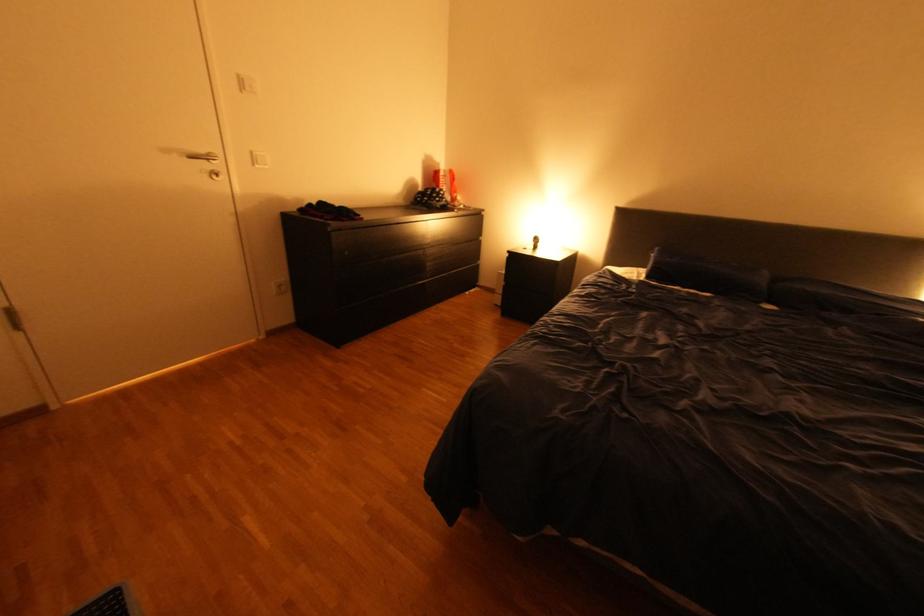
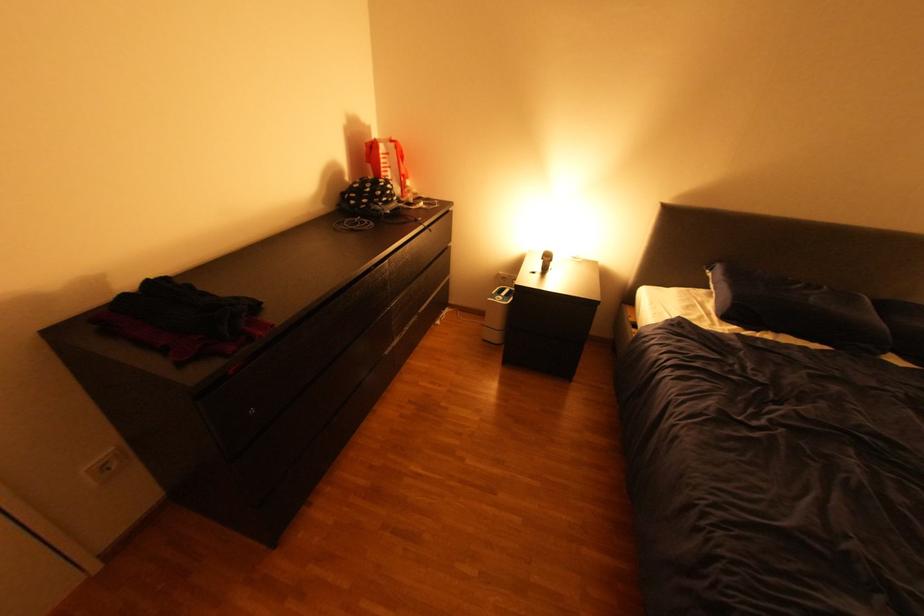
Find the pixel in the second image that matches pixel 549 244 in the first image.

(561, 262)